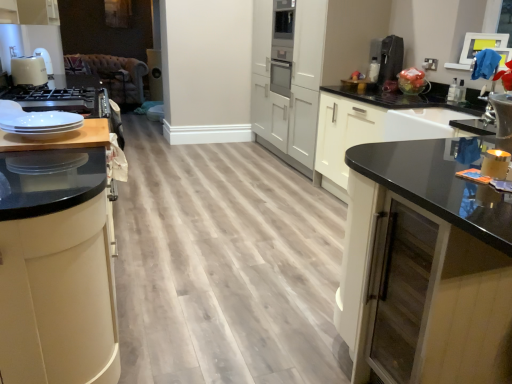
Question: Does point (80, 59) appear closer or farther from the camera than point (393, 38)?

Choices:
 (A) closer
 (B) farther

Answer: (B)

Question: Considering the positions of brown leather couch at upper left and satin black coffee machine at upper right in the image, is brown leather couch at upper left wider or thinner than satin black coffee machine at upper right?

Choices:
 (A) thin
 (B) wide

Answer: (B)

Question: Estimate the real-world distances between objects in this image. Which object is farther from the black glass cabinet at right, placed as the first cabinetry when sorted from right to left?

Choices:
 (A) matte black cabinet at left, which is the second cabinetry from right to left
 (B) wooden cutting board at left
 (C) brown leather couch at upper left
 (D) satin black coffee machine at upper right

Answer: (C)

Question: Which object is positioned farthest from the black glass cabinet at right, the second cabinetry when ordered from left to right?

Choices:
 (A) satin black coffee machine at upper right
 (B) matte black cabinet at left, positioned as the 1th cabinetry in left-to-right order
 (C) wooden cutting board at left
 (D) brown leather couch at upper left

Answer: (D)